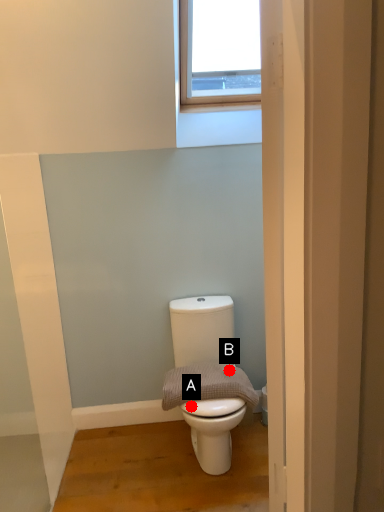
Question: Two points are circled on the image, labeled by A and B beside each circle. Which of the following is the farthest from the observer?

Choices:
 (A) A is further
 (B) B is further

Answer: (B)